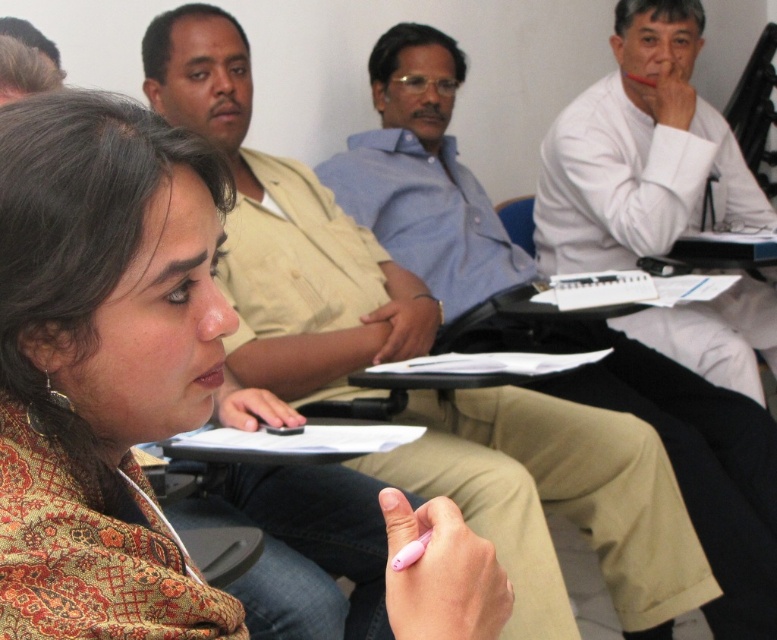
Where is `blue shirt at upper center`? blue shirt at upper center is located at coordinates (556, 323).

Can you confirm if blue shirt at upper center is shorter than white smooth shirt at upper right?

No, blue shirt at upper center is not shorter than white smooth shirt at upper right.

Between point (751, 461) and point (629, 68), which one is positioned in front?

Positioned in front is point (751, 461).

Locate an element on the screen. This screenshot has height=640, width=777. blue shirt at upper center is located at coordinates (556, 323).

Does white smooth shirt at upper right have a larger size compared to blue fabric chair at center?

Yes.

Between point (727, 145) and point (528, 212), which one is positioned behind?

The point (528, 212) is more distant.

Identify the location of white smooth shirt at upper right. (639, 150).

Who is shorter, patterned fabric jacket at center or blue shirt at upper center?

patterned fabric jacket at center is shorter.

Is patterned fabric jacket at center above blue shirt at upper center?

Incorrect, patterned fabric jacket at center is not positioned above blue shirt at upper center.

Is point (204, 346) less distant than point (488, 228)?

Yes, it is.

Identify the location of patterned fabric jacket at center. (110, 269).